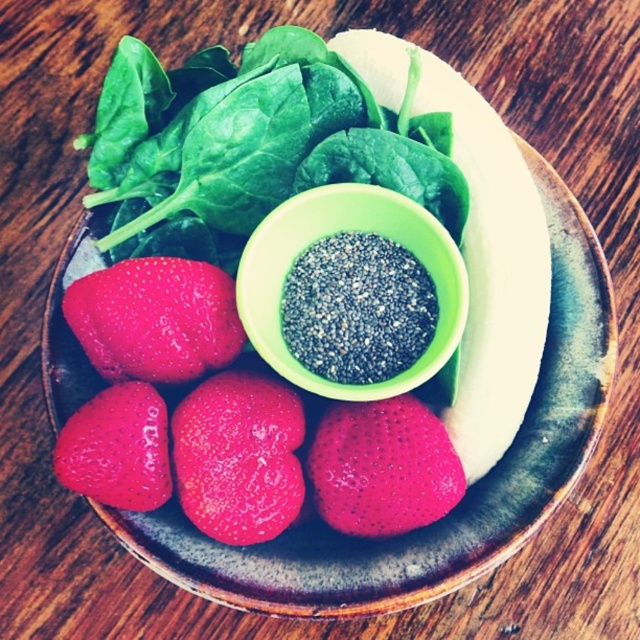
From the picture: You are preparing a fruit salad and need to know if the glossy red strawberry at center can fit inside the green matte bowl at center. Based on the scene description, can it?

The green matte bowl at center has a larger size compared to glossy red strawberry at center, so yes, the glossy red strawberry at center can fit inside the green matte bowl at center.

You are a chef preparing a smoothie and need to quickly access both the green matte bowl at center and the black granular powder at center. Given that your hand can move 1 inch per second, how many seconds will it take to move from one to the other?

The distance between the green matte bowl at center and the black granular powder at center is 1.26 inches. Since your hand moves at 1 inch per second, it will take approximately 1.26 seconds to move between them.

You are a chef preparing a dish and need to locate the green matte bowl at center on the plate. Where exactly is it positioned?

The green matte bowl at center is located at point coordinates of 0.366 on the x axis and 0.522 on the y axis.